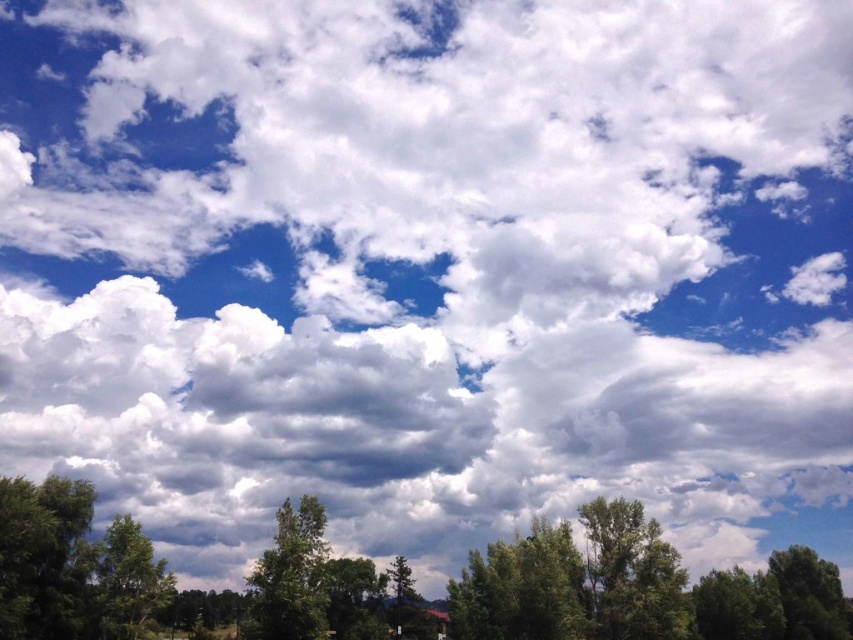
Which of these two, green leafy tree at lower center or green leafy tree at lower left, stands shorter?

Standing shorter between the two is green leafy tree at lower left.

Is green leafy tree at lower center below green leafy tree at lower left?

Yes.

Identify the location of green leafy tree at lower center. Image resolution: width=853 pixels, height=640 pixels. (172, 577).

At what (x,y) coordinates should I click in order to perform the action: click on green leafy tree at lower center. Please return your answer as a coordinate pair (x, y). This screenshot has width=853, height=640. Looking at the image, I should click on (172, 577).

Can you confirm if green leafy tree at center is positioned above green leafy tree at lower left?

Incorrect, green leafy tree at center is not positioned above green leafy tree at lower left.

At what (x,y) coordinates should I click in order to perform the action: click on green leafy tree at center. Please return your answer as a coordinate pair (x, y). The image size is (853, 640). Looking at the image, I should click on (289, 577).

Is green leafy tree at lower center below green leafy tree at center?

Indeed, green leafy tree at lower center is positioned under green leafy tree at center.

This screenshot has height=640, width=853. In order to click on green leafy tree at lower center in this screenshot , I will do `click(172, 577)`.